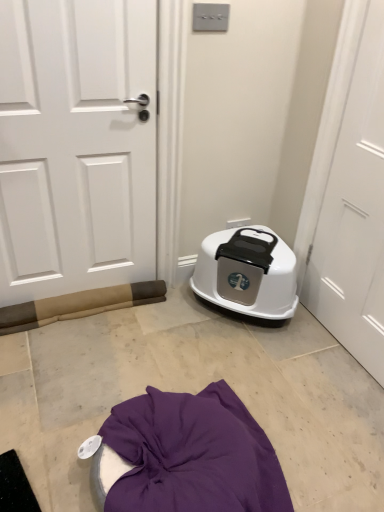
Question: Is white matte door at right, which is counted as the first door, starting from the right, located within white matte door at left, acting as the second door starting from the right?

Choices:
 (A) yes
 (B) no

Answer: (B)

Question: Is white matte door at left, the first door positioned from the left, oriented away from white matte door at right, arranged as the second door when viewed from the left?

Choices:
 (A) yes
 (B) no

Answer: (B)

Question: Can you confirm if white matte door at left, acting as the second door starting from the right, is smaller than white matte door at right, which is counted as the first door, starting from the right?

Choices:
 (A) yes
 (B) no

Answer: (B)

Question: Considering the relative sizes of white matte door at left, acting as the second door starting from the right, and white matte door at right, arranged as the second door when viewed from the left, in the image provided, is white matte door at left, acting as the second door starting from the right, taller than white matte door at right, arranged as the second door when viewed from the left,?

Choices:
 (A) yes
 (B) no

Answer: (B)

Question: From a real-world perspective, is white matte door at left, the first door positioned from the left, below white matte door at right, which is counted as the first door, starting from the right?

Choices:
 (A) no
 (B) yes

Answer: (B)

Question: Relative to white matte door at left, the first door positioned from the left, is white plastic litter box at center in front or behind?

Choices:
 (A) behind
 (B) front

Answer: (A)

Question: Is point (198, 274) positioned closer to the camera than point (81, 242)?

Choices:
 (A) closer
 (B) farther

Answer: (B)

Question: In terms of height, does white plastic litter box at center look taller or shorter compared to white matte door at left, acting as the second door starting from the right?

Choices:
 (A) short
 (B) tall

Answer: (A)

Question: In terms of size, does white plastic litter box at center appear bigger or smaller than white matte door at left, acting as the second door starting from the right?

Choices:
 (A) big
 (B) small

Answer: (A)

Question: From the image's perspective, is white matte door at right, which is counted as the first door, starting from the right, positioned above or below white matte door at left, acting as the second door starting from the right?

Choices:
 (A) above
 (B) below

Answer: (B)

Question: Is white matte door at right, which is counted as the first door, starting from the right, situated inside white matte door at left, acting as the second door starting from the right, or outside?

Choices:
 (A) inside
 (B) outside

Answer: (B)

Question: Considering the relative positions of white matte door at right, which is counted as the first door, starting from the right, and white matte door at left, the first door positioned from the left, in the image provided, is white matte door at right, which is counted as the first door, starting from the right, to the left or to the right of white matte door at left, the first door positioned from the left,?

Choices:
 (A) left
 (B) right

Answer: (B)

Question: Is white matte door at right, arranged as the second door when viewed from the left, in front of or behind white matte door at left, acting as the second door starting from the right, in the image?

Choices:
 (A) behind
 (B) front

Answer: (B)

Question: Is white matte door at left, the first door positioned from the left, to the left or to the right of white matte door at right, arranged as the second door when viewed from the left, in the image?

Choices:
 (A) right
 (B) left

Answer: (B)

Question: Looking at their shapes, would you say white matte door at left, the first door positioned from the left, is wider or thinner than white matte door at right, arranged as the second door when viewed from the left?

Choices:
 (A) thin
 (B) wide

Answer: (B)